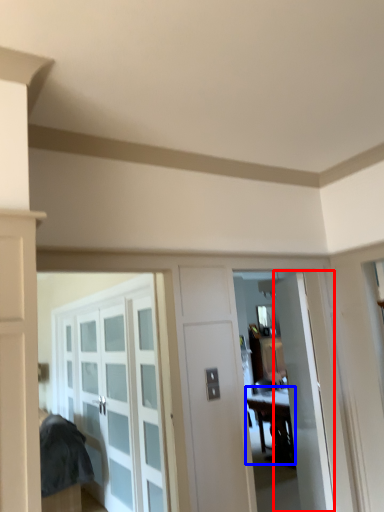
Question: Which object is closer to the camera taking this photo, door (highlighted by a red box) or table (highlighted by a blue box)?

Choices:
 (A) door
 (B) table

Answer: (A)